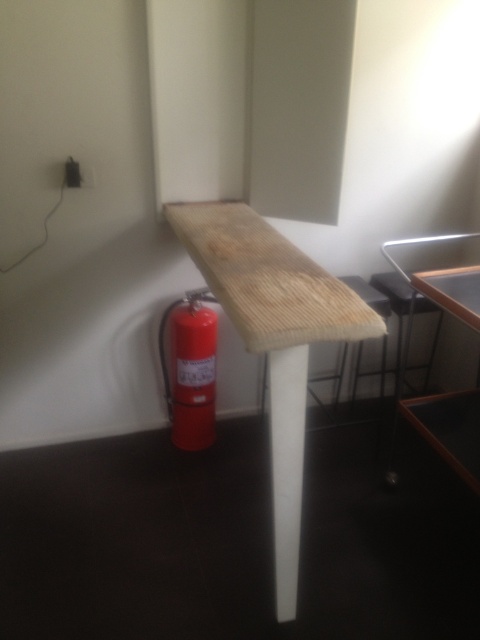
You are standing in the room and see two points marked on the wall. The first point is at coordinates point (276, 272) and the second is at point (175, 330). Which point is closer to you?

Point (276, 272) is in front of point (175, 330), so it is closer to you.

You are organizing a small event in the room and need to move the red metallic fire extinguisher at lower left closer to the natural wood table at center. Which direction should you move it to place it next to the table?

The natural wood table at center is to the right of the red metallic fire extinguisher at lower left. To place the fire extinguisher next to the table, move it to the right so it is positioned near the natural wood table at center.